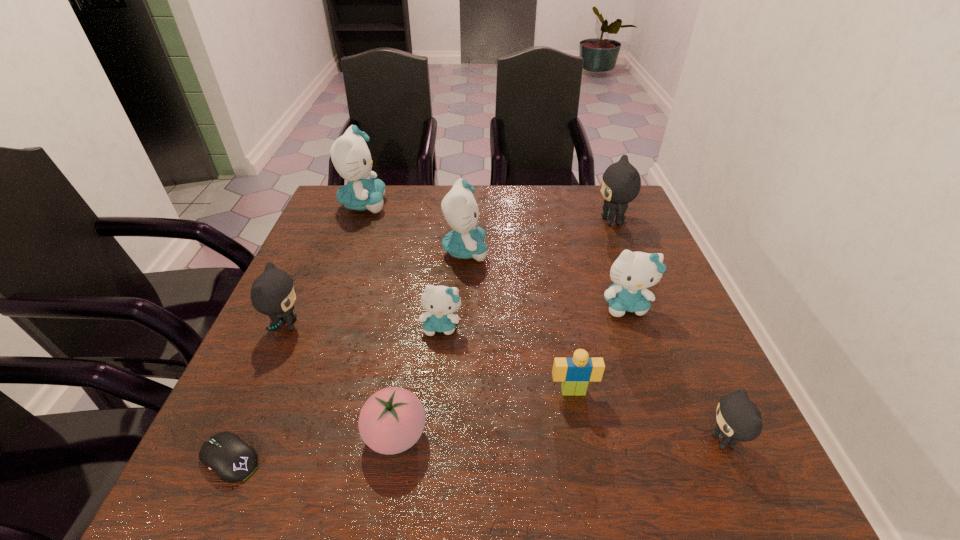
Find the location of a particular element. This screenshot has width=960, height=540. vacant area that lies between the leftmost gray kitten and the shortest object is located at coordinates (258, 392).

Locate an element on the screen. Image resolution: width=960 pixels, height=540 pixels. unoccupied area between the second smallest blue kitten and the third smallest blue kitten is located at coordinates (545, 279).

Image resolution: width=960 pixels, height=540 pixels. What are the coordinates of `free space between the black computer equipment and the second biggest blue kitten` in the screenshot? It's located at (348, 355).

Select which object appears as the eighth closest to the second biggest blue kitten. Please provide its 2D coordinates. Your answer should be formatted as a tuple, i.e. [(x, y)], where the tuple contains the x and y coordinates of a point satisfying the conditions above.

[(226, 454)]

Identify the location of the third closest object to the second biggest blue kitten. (632, 272).

Image resolution: width=960 pixels, height=540 pixels. I want to click on kitten that is the third closest to the rightmost blue kitten, so click(x=459, y=207).

Locate which kitten ranks third in proximity to the second biggest gray kitten. Please provide its 2D coordinates. Your answer should be formatted as a tuple, i.e. [(x, y)], where the tuple contains the x and y coordinates of a point satisfying the conditions above.

[(350, 155)]

Locate an element on the screen. This screenshot has width=960, height=540. blue kitten that can be found as the third closest to the second farthest blue kitten is located at coordinates [632, 272].

At what (x,y) coordinates should I click in order to perform the action: click on blue kitten object that ranks as the second closest to the leftmost gray kitten. Please return your answer as a coordinate pair (x, y). Looking at the image, I should click on (459, 207).

Image resolution: width=960 pixels, height=540 pixels. I want to click on gray kitten that is the third closest to the computer equipment, so click(x=621, y=182).